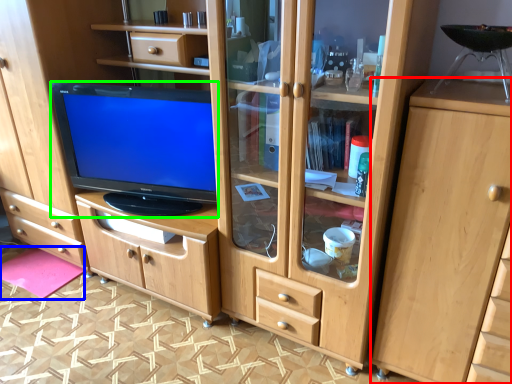
Question: Which object is the farthest from cabinetry (highlighted by a red box)? Choose among these: flat (highlighted by a blue box) or television (highlighted by a green box).

Choices:
 (A) flat
 (B) television

Answer: (A)